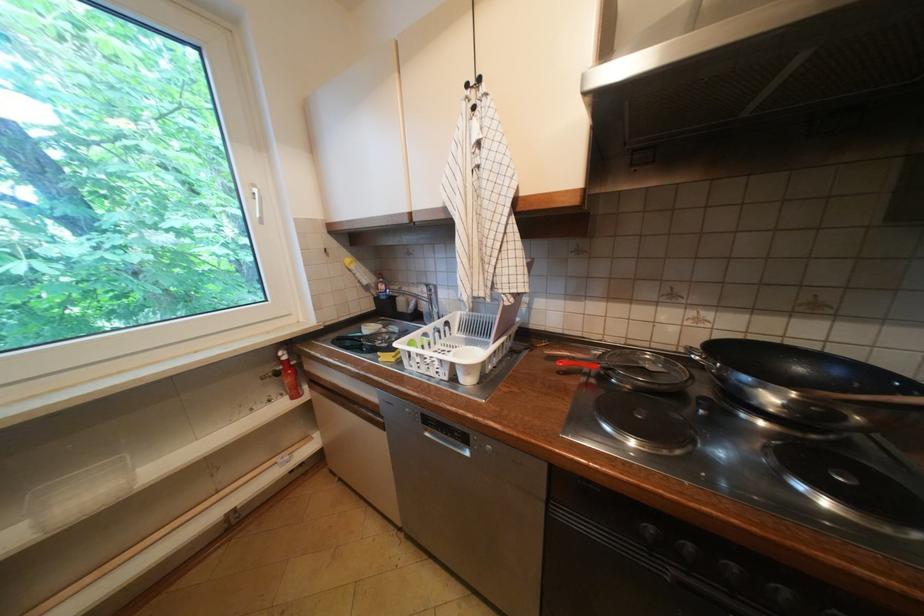
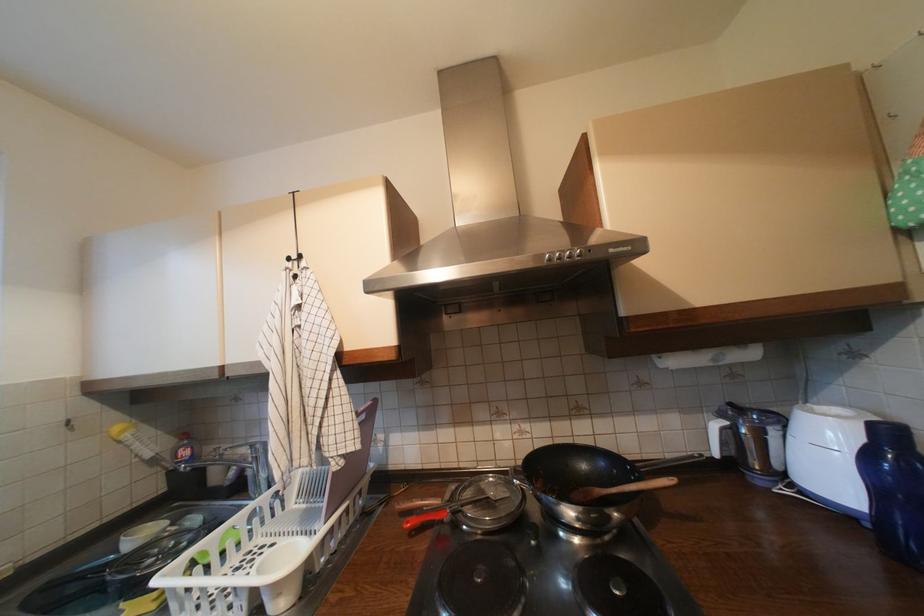
Find the pixel in the second image that matches point 569,363 in the first image.

(417, 524)